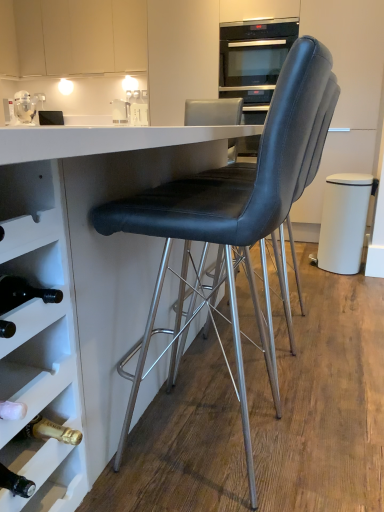
Locate an element on the screen. free point to the right of black leather chair at center, which is the second chair from back to front is located at coordinates (342, 429).